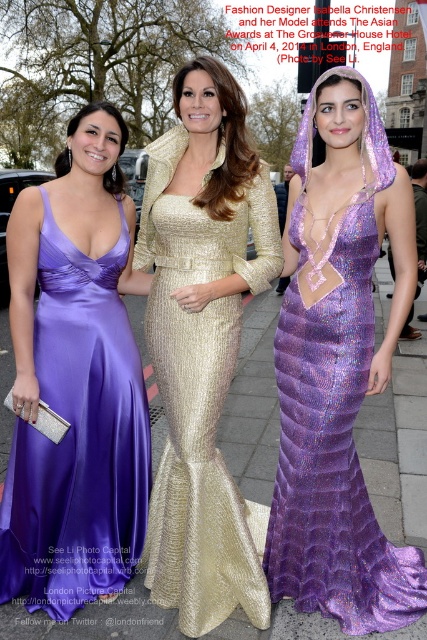
Can you confirm if purple satin dress at center is thinner than gold sequined dress at center?

Yes.

This screenshot has width=427, height=640. I want to click on purple satin dress at center, so click(76, 380).

Who is higher up, purple sequined dress at center or gold sequined dress at center?

Positioned higher is gold sequined dress at center.

Is purple sequined dress at center shorter than gold sequined dress at center?

Correct, purple sequined dress at center is not as tall as gold sequined dress at center.

Locate an element on the screen. purple sequined dress at center is located at coordinates (338, 376).

Measure the distance from purple satin dress at center to purple sequined dress at center.

purple satin dress at center is 32.19 inches away from purple sequined dress at center.

Does purple satin dress at center have a smaller size compared to purple sequined dress at center?

Yes.

This screenshot has height=640, width=427. I want to click on purple satin dress at center, so click(76, 380).

What are the coordinates of `purple satin dress at center` in the screenshot? It's located at (76, 380).